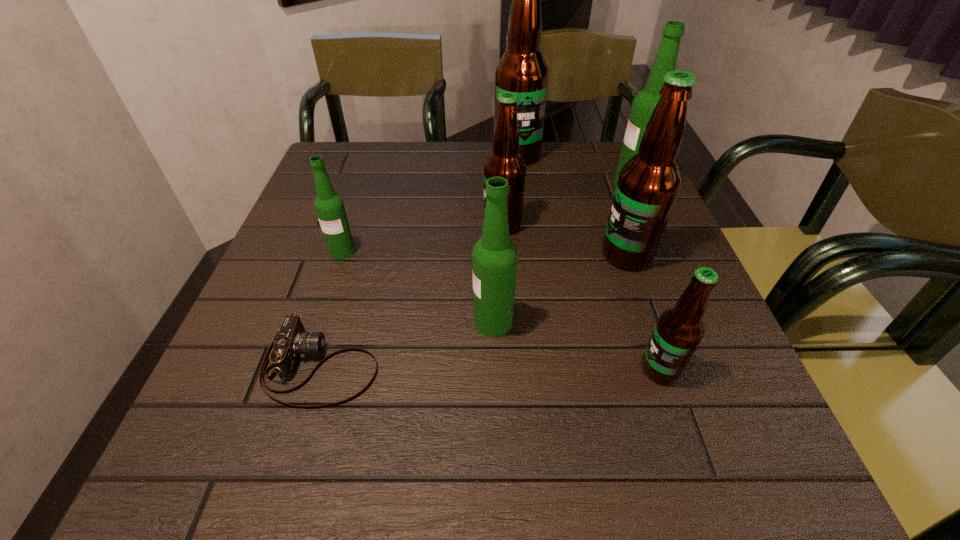
Where is `the biggest brown beer bottle`? This screenshot has height=540, width=960. the biggest brown beer bottle is located at coordinates (522, 69).

This screenshot has width=960, height=540. I want to click on the farthest beer bottle, so click(x=522, y=69).

In order to click on the rightmost green beer bottle in this screenshot , I will do `click(644, 103)`.

The image size is (960, 540). What are the coordinates of `the biggest green beer bottle` in the screenshot? It's located at (644, 103).

Where is `the third farthest brown beer bottle`? Image resolution: width=960 pixels, height=540 pixels. the third farthest brown beer bottle is located at coordinates [x=648, y=184].

The height and width of the screenshot is (540, 960). In order to click on the third farthest object in this screenshot , I will do `click(505, 161)`.

Image resolution: width=960 pixels, height=540 pixels. Find the location of `the second farthest brown beer bottle`. the second farthest brown beer bottle is located at coordinates (505, 161).

This screenshot has width=960, height=540. In order to click on the sixth farthest beer bottle in this screenshot , I will do `click(494, 256)`.

Where is `the nearest green beer bottle`? the nearest green beer bottle is located at coordinates (494, 256).

Locate an element on the screen. the nearest brown beer bottle is located at coordinates (679, 330).